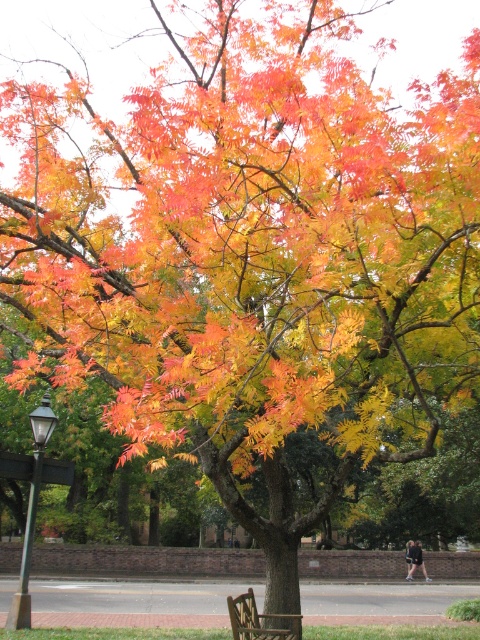
Is green metal lamp post at left above wooden park bench at lower center?

Correct, green metal lamp post at left is located above wooden park bench at lower center.

Measure the distance between point (35, 513) and camera.

11.14 meters

In order to click on green metal lamp post at left in this screenshot , I will do `click(33, 499)`.